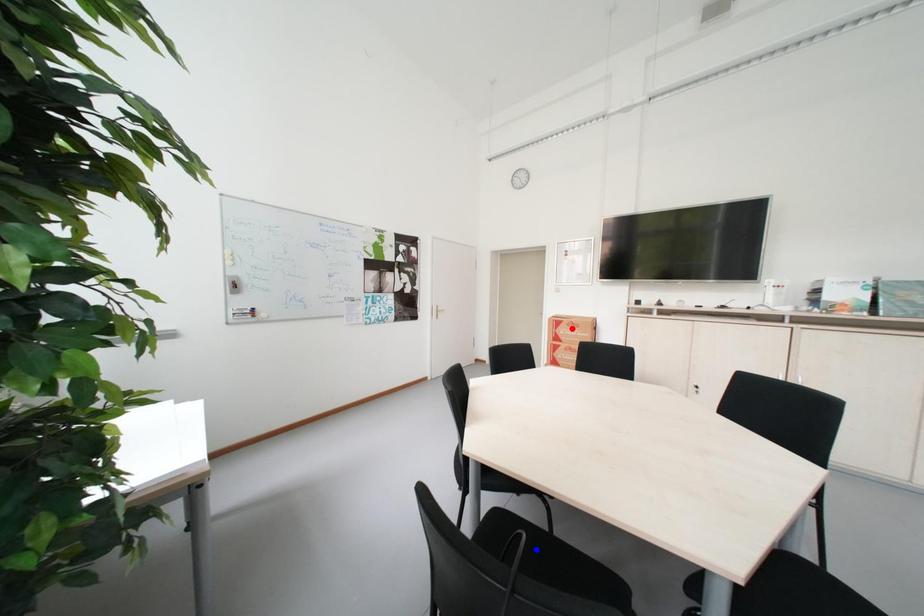
Question: Which of the two points in the image is closer to the camera?

Choices:
 (A) Blue point is closer.
 (B) Red point is closer.

Answer: (A)